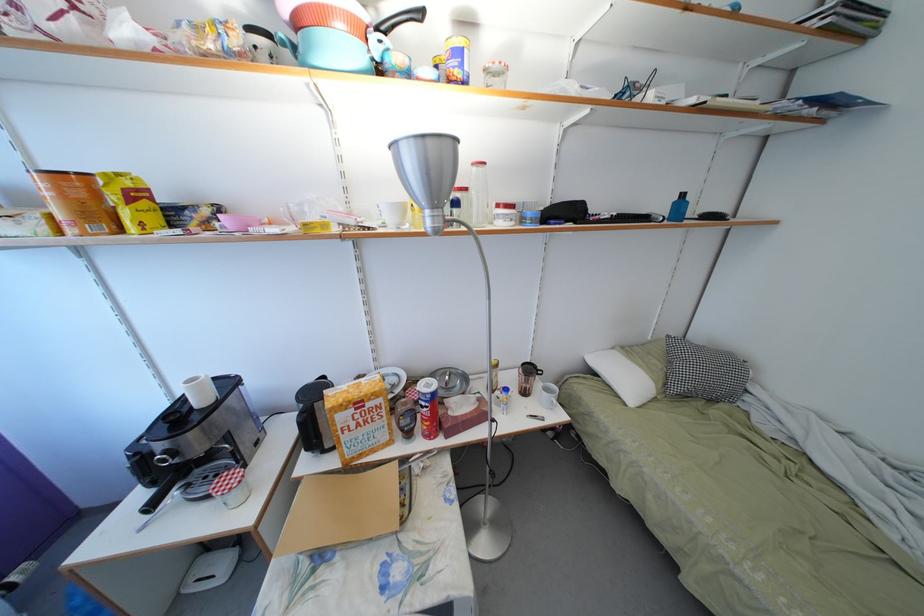
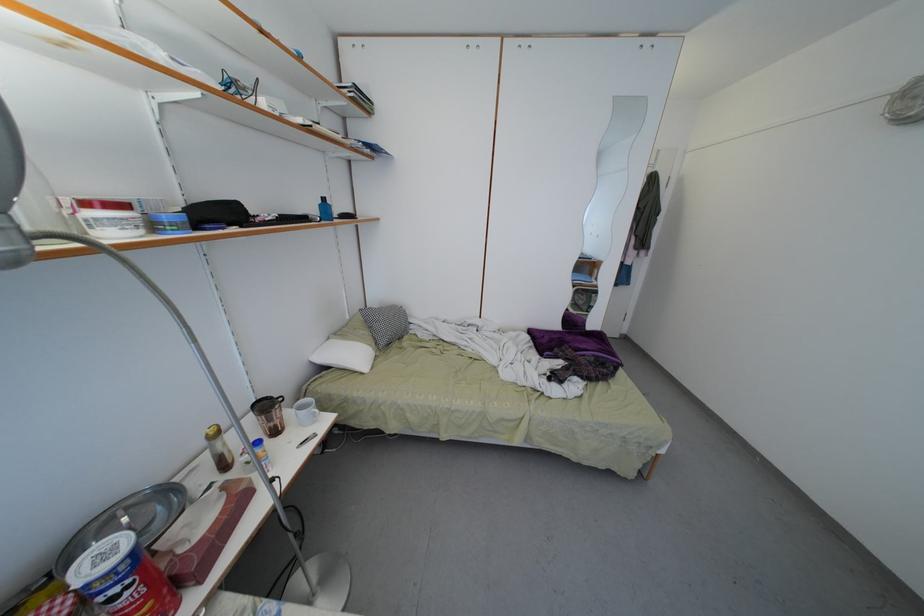
Question: Based on the continuous images, in which direction is the camera rotating? Reply with the corresponding letter.

Choices:
 (A) Left
 (B) Right
 (C) Up
 (D) Down

Answer: (B)